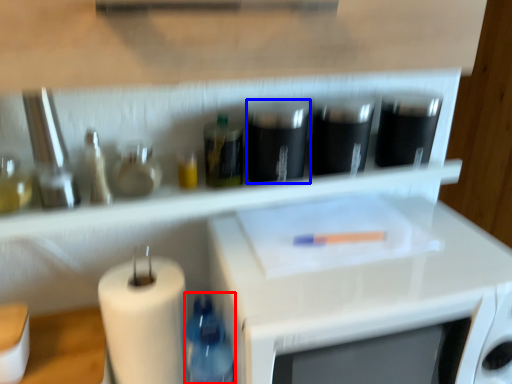
Question: Which object is further to the camera taking this photo, bottle (highlighted by a red box) or appliance (highlighted by a blue box)?

Choices:
 (A) bottle
 (B) appliance

Answer: (B)